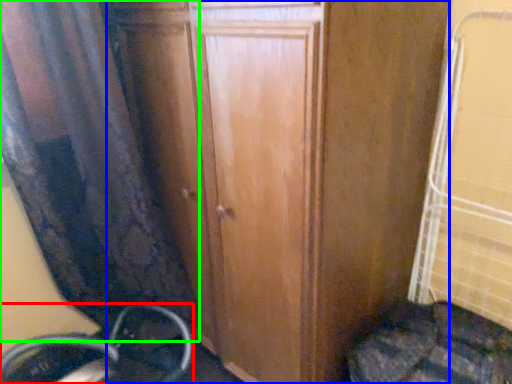
Question: Which is farther away from wheel (highlighted by a red box)? door (highlighted by a blue box) or curtain (highlighted by a green box)?

Choices:
 (A) door
 (B) curtain

Answer: (A)